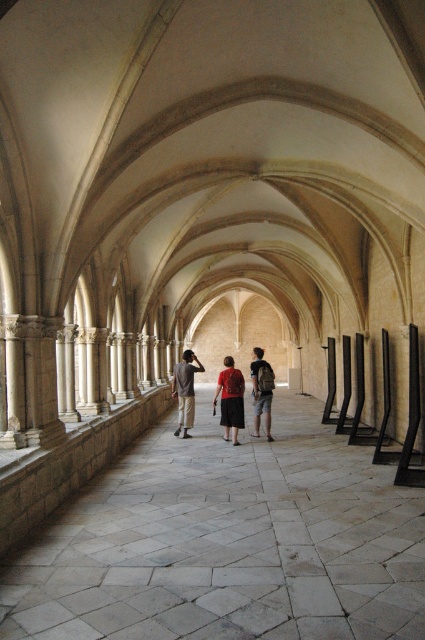
You are standing at the camera position in the corridor and want to walk to point (22, 608). How far will you have to walk?

The distance between point (22, 608) and the camera is 5.41 meters, so you will have to walk 5.41 meters.

You are standing in the historical corridor and see the gray stone walkway at center and the matte red blouse at center. From your perspective, which object is positioned to the right?

The gray stone walkway at center is to the right of the matte red blouse at center.